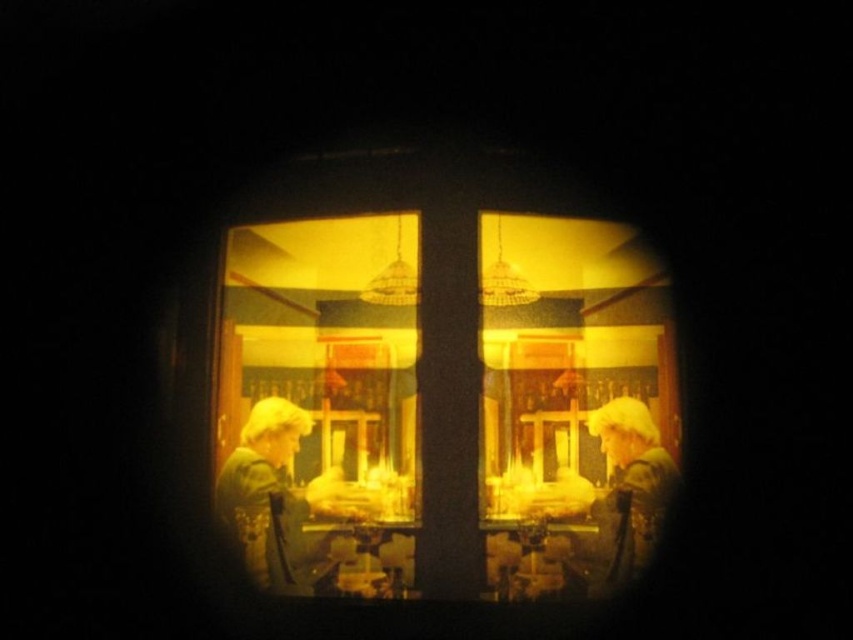
Can you confirm if matte glass shop window at center is taller than matte green dress at center?

Yes, matte glass shop window at center is taller than matte green dress at center.

Does matte glass shop window at center appear over matte green dress at center?

Yes, matte glass shop window at center is above matte green dress at center.

At what (x,y) coordinates should I click in order to perform the action: click on matte glass shop window at center. Please return your answer as a coordinate pair (x, y). The image size is (853, 640). Looking at the image, I should click on (444, 403).

Find the location of `matte glass shop window at center`. matte glass shop window at center is located at coordinates (444, 403).

Between matte green dress at center and matte silver helmet at center, which one is positioned lower?

matte green dress at center is lower down.

Describe the element at coordinates (274, 499) in the screenshot. I see `matte green dress at center` at that location.

At what (x,y) coordinates should I click in order to perform the action: click on matte green dress at center. Please return your answer as a coordinate pair (x, y). This screenshot has height=640, width=853. Looking at the image, I should click on (274, 499).

You are a GUI agent. You are given a task and a screenshot of the screen. Output one action in this format:
    pyautogui.click(x=<x>, y=<y>)
    Task: Click on the matte green dress at center
    
    Given the screenshot: What is the action you would take?
    pyautogui.click(x=274, y=499)

In the scene shown: Between matte glass shop window at center and matte silver helmet at center, which one has less height?

matte silver helmet at center

The image size is (853, 640). I want to click on matte glass shop window at center, so click(x=444, y=403).